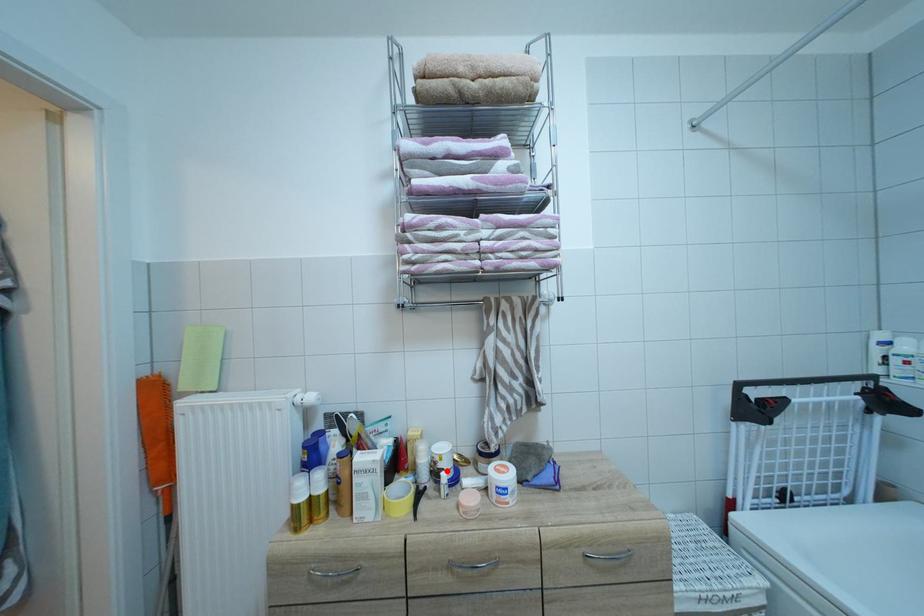
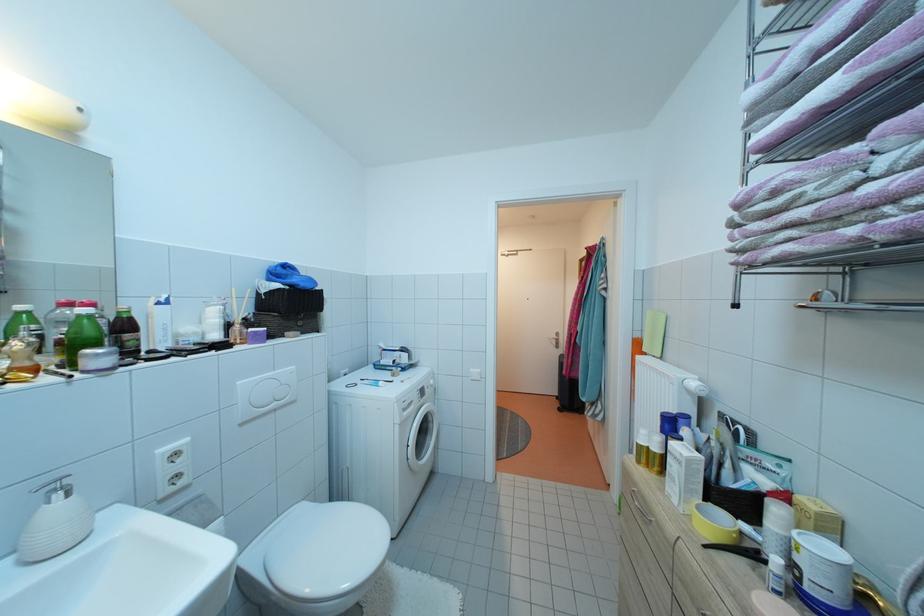
Where in the second image is the point corresponding to the highlighted location from the first image?

(805, 565)